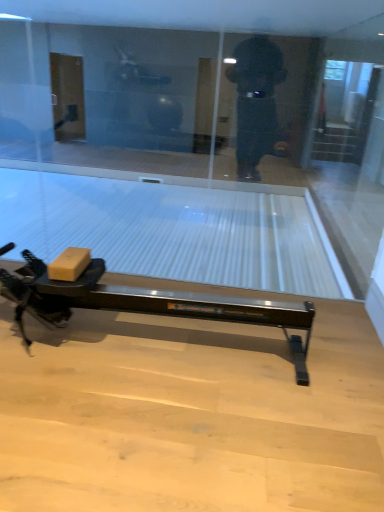
Question: Is transparent glass screen door at upper right to the left or to the right of matte cardboard box at lower left in the image?

Choices:
 (A) left
 (B) right

Answer: (B)

Question: From the image's perspective, is transparent glass screen door at upper right located above or below matte cardboard box at lower left?

Choices:
 (A) below
 (B) above

Answer: (B)

Question: Which is nearer to the transparent glass screen door at upper right?

Choices:
 (A) matte cardboard box at lower left
 (B) transparent glass at center

Answer: (B)

Question: Which object is positioned closest to the transparent glass at center?

Choices:
 (A) matte cardboard box at lower left
 (B) transparent glass screen door at upper right

Answer: (A)